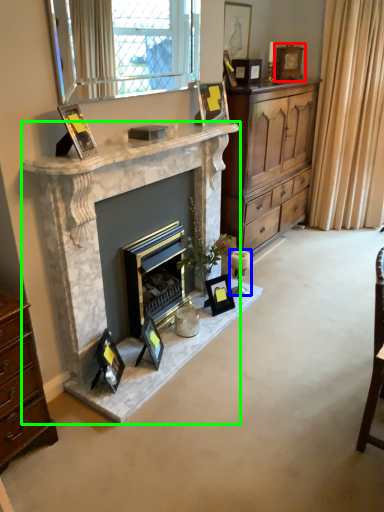
Question: Which is nearer to the picture frame (highlighted by a red box)? candle holder (highlighted by a blue box) or fireplace (highlighted by a green box).

Choices:
 (A) candle holder
 (B) fireplace

Answer: (A)